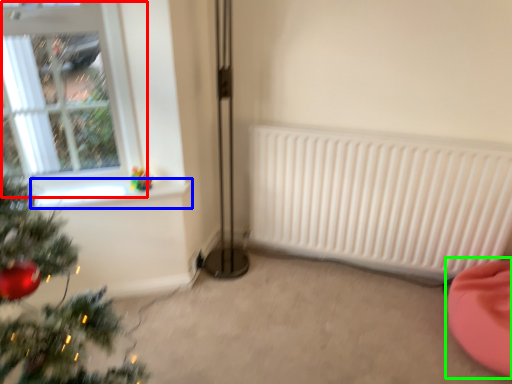
Question: Based on their relative distances, which object is farther from window (highlighted by a red box)? Choose from window sill (highlighted by a blue box) and bean bag chair (highlighted by a green box).

Choices:
 (A) window sill
 (B) bean bag chair

Answer: (B)